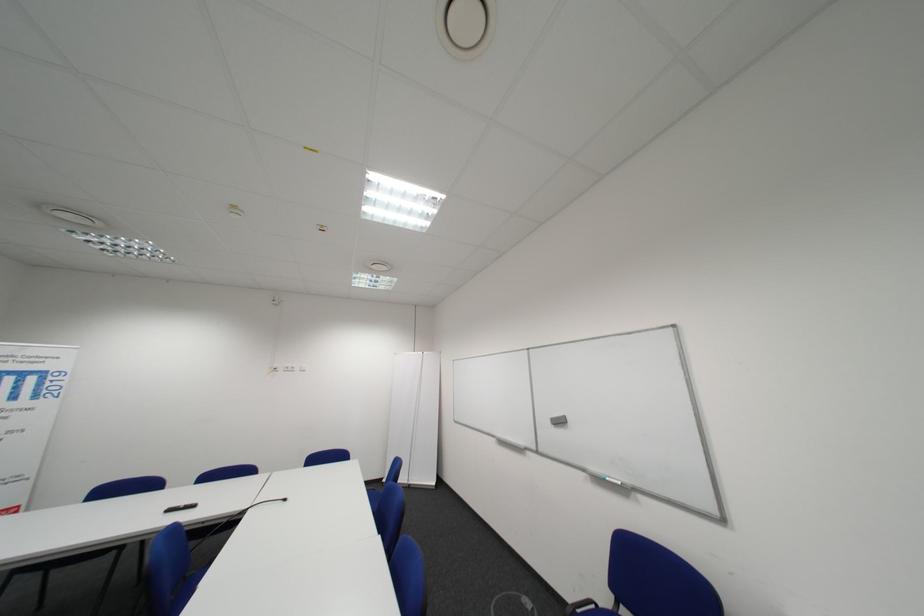
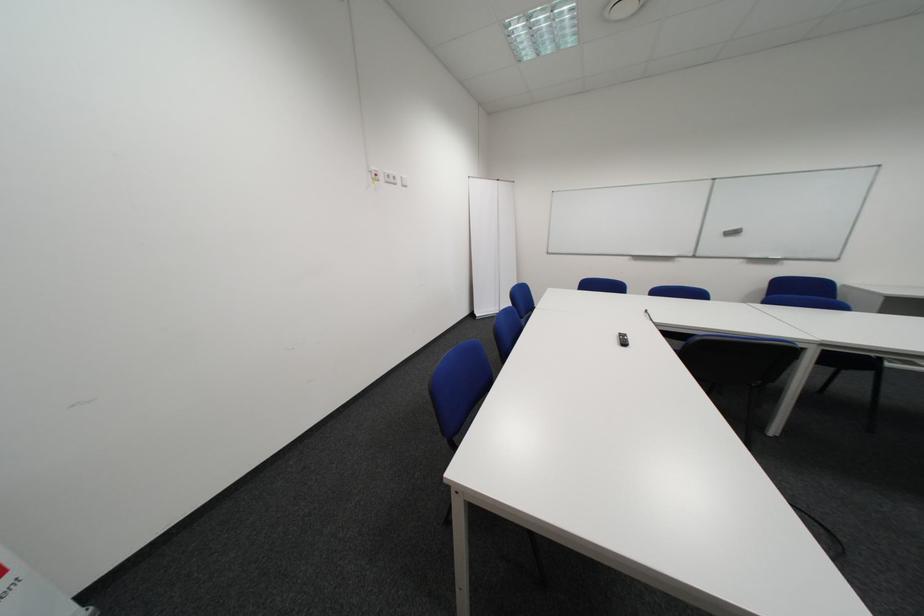
The point at (305, 369) is marked in the first image. Where is the corresponding point in the second image?

(407, 179)